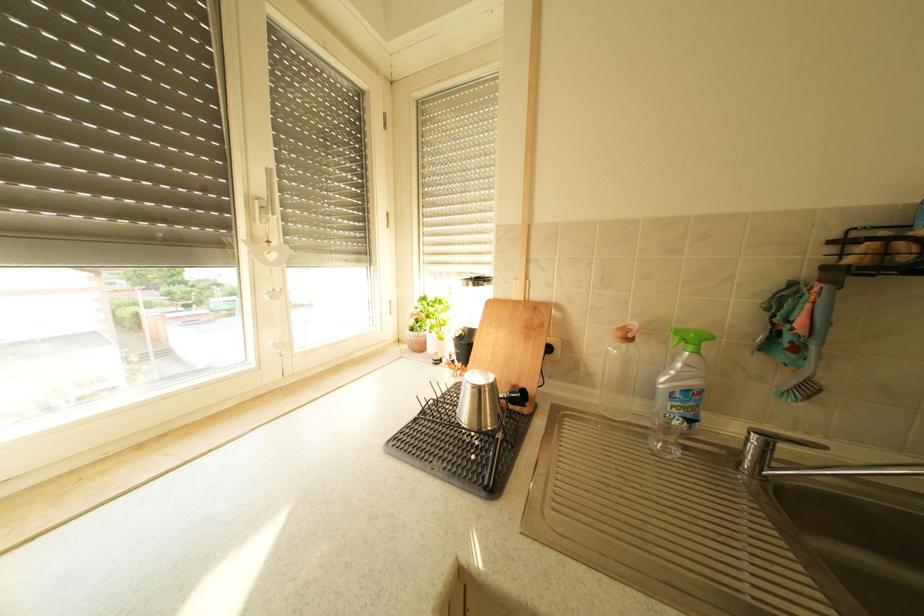
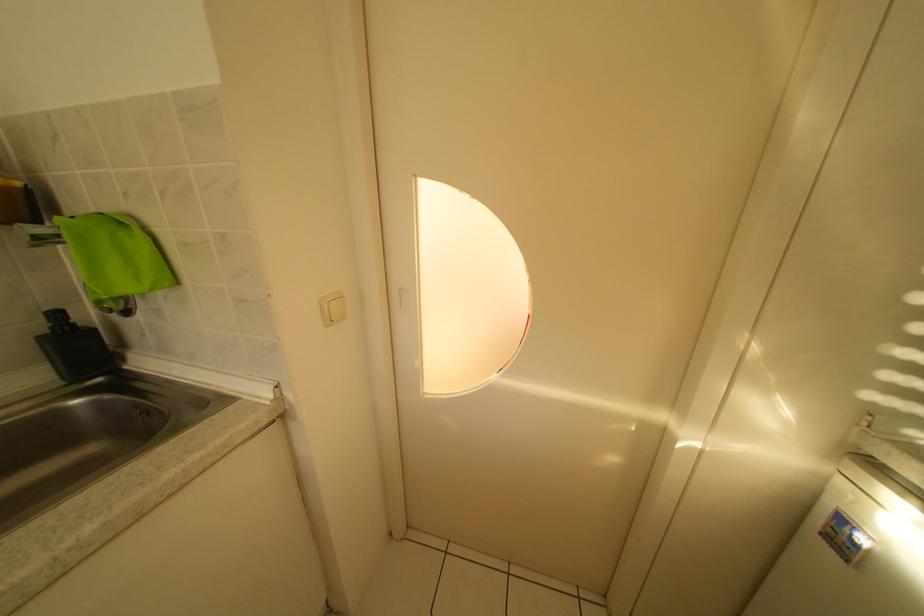
How did the camera likely rotate?

The rotation direction of the camera is right-down.